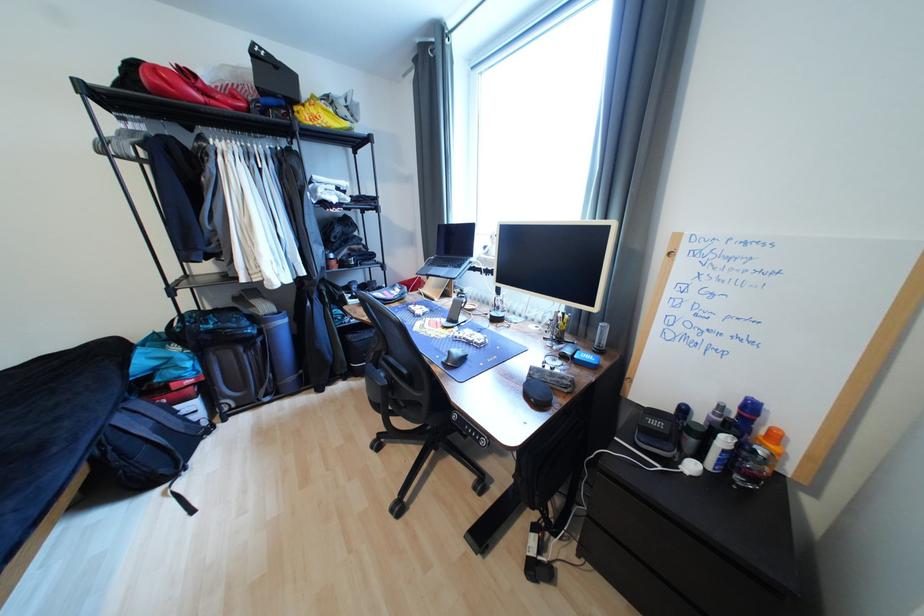
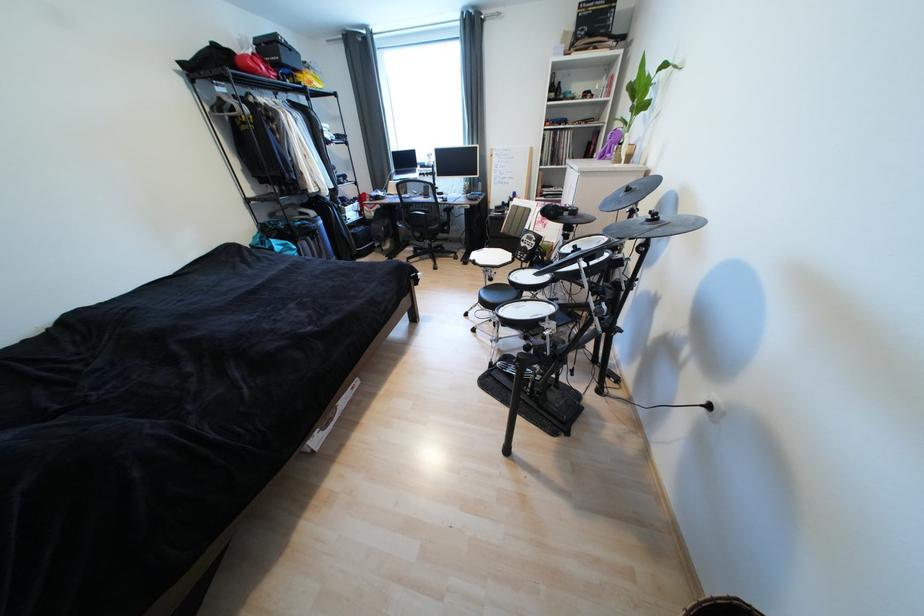
In the second image, find the point that corresponds to point 281,95 in the first image.

(294, 68)